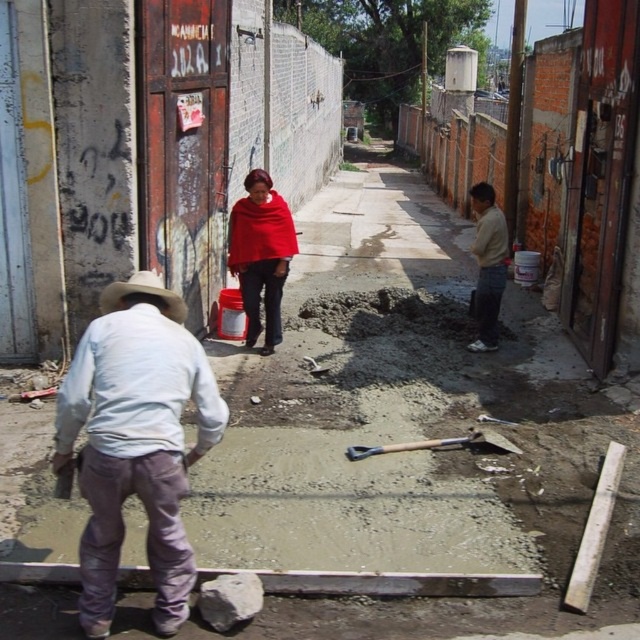
Question: Does light beige sweater at right appear on the left side of wooden handle shovel at center?

Choices:
 (A) yes
 (B) no

Answer: (B)

Question: Can you confirm if red woolen shawl at center is smaller than wooden handle shovel at center?

Choices:
 (A) no
 (B) yes

Answer: (A)

Question: Among these objects, which one is farthest from the camera?

Choices:
 (A) light beige sweater at right
 (B) red woolen shawl at center
 (C) light blue cotton shirt at left
 (D) wooden handle shovel at center

Answer: (A)

Question: Estimate the real-world distances between objects in this image. Which object is closer to the light blue cotton shirt at left?

Choices:
 (A) wooden handle shovel at center
 (B) light beige sweater at right
 (C) red woolen shawl at center

Answer: (A)

Question: Can you confirm if red woolen shawl at center is thinner than wooden handle shovel at center?

Choices:
 (A) yes
 (B) no

Answer: (A)

Question: Which point is closer to the camera taking this photo?

Choices:
 (A) (179, 470)
 (B) (241, 284)
 (C) (492, 266)

Answer: (A)